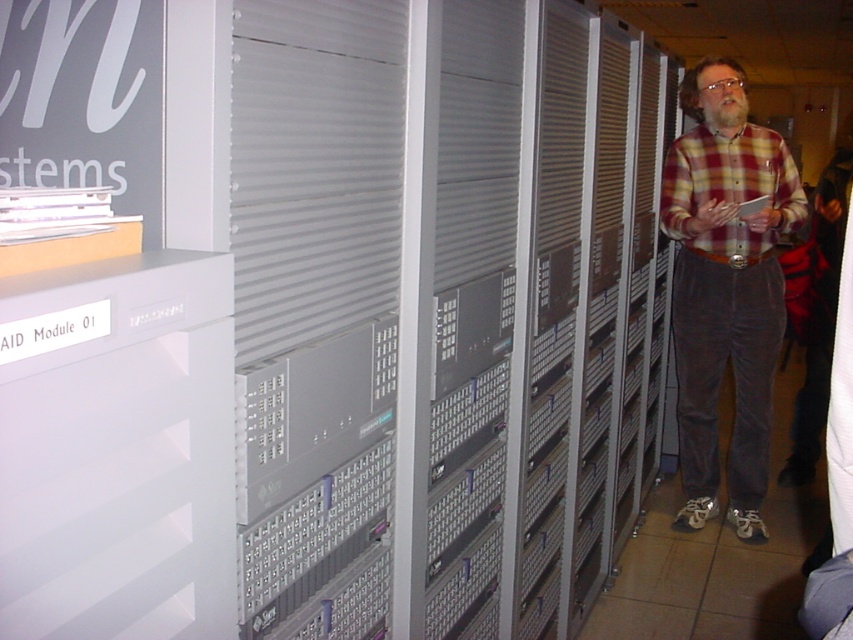
You are an IT technician in a server room and need to place both the plaid flannel shirt at center and the plaid cotton shirt at right onto a shelf that can only hold items where the larger one is placed below the smaller one. Based on the scene description, which shirt should go on the bottom shelf?

The plaid flannel shirt at center is larger in size than the plaid cotton shirt at right, so it should be placed on the bottom shelf to ensure stability.

You are standing in the server room and see two points marked on the server rack. The first point is at coordinate point(764, 314) and the second point is at point(749, 237). Which point is closer to you?

Point(749, 237) is closer to you because it is less further to the camera than point(764, 314).